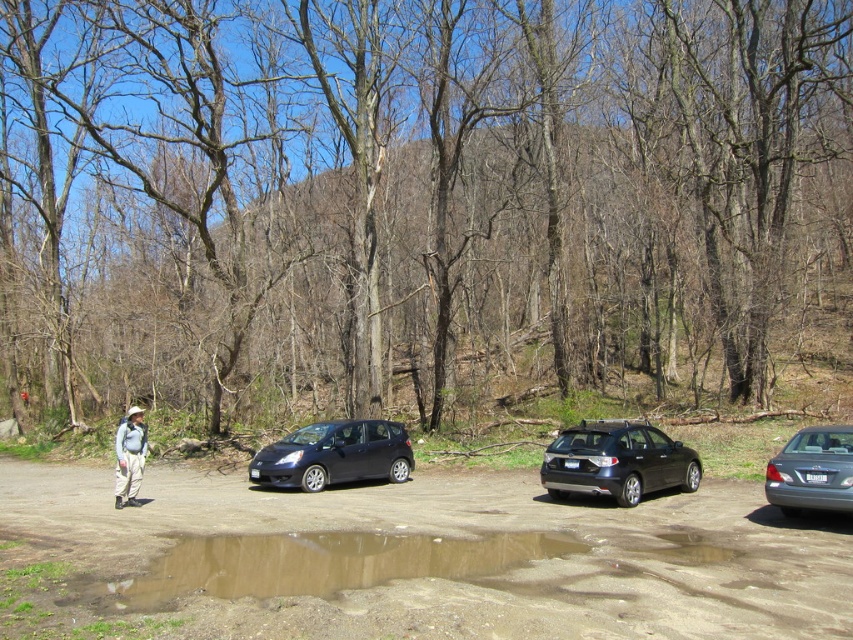
You are a hiker planning to drive your car to the forest trailhead. You see the brown dirt track at lower center and the brown sandy puddle at center. Which of these two features is bigger in size?

The brown dirt track at lower center is larger in size than the brown sandy puddle at center.

In the scene shown: You are standing at the edge of the parking area where the person is located. You need to reach the brown dirt track at lower center. Which direction should you walk to reach it?

The brown dirt track at lower center is located at point (x=469, y=534), so you should walk towards the lower center direction to reach it.

You are standing at the point marked as point (469,534) in the image. What is the terrain like at that location?

The terrain at point (469,534) is brown dirt track at lower center.